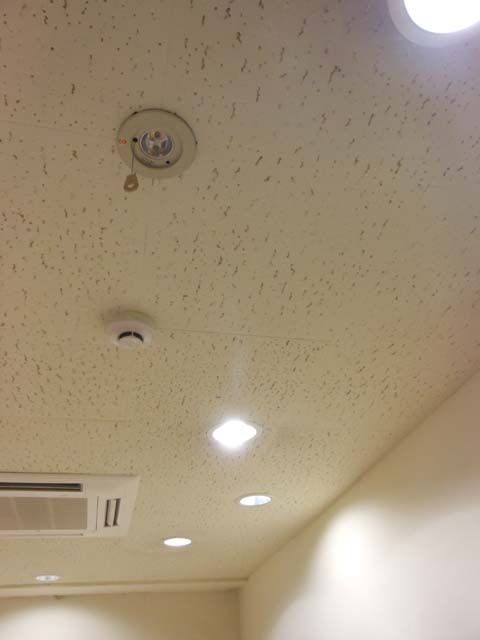
Where is `light`? light is located at coordinates [x=177, y=153].